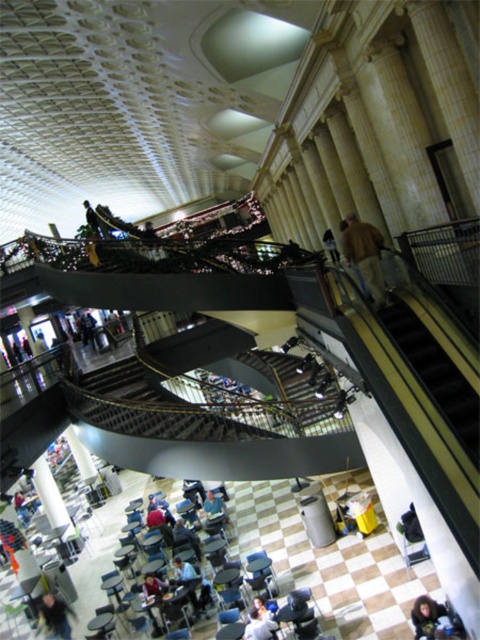
Question: Which point is closer to the camera?

Choices:
 (A) (155, 236)
 (B) (467, 401)
 (C) (264, 618)
 (D) (297, 362)

Answer: (B)

Question: Which object appears farthest from the camera in this image?

Choices:
 (A) brown leather jacket at upper right
 (B) metallic staircase at center

Answer: (B)

Question: In this image, where is metallic staircase at center located relative to dark blue jeans at lower left?

Choices:
 (A) above
 (B) below

Answer: (A)

Question: Observing the image, what is the correct spatial positioning of brown leather jacket at upper right in reference to dark blue jeans at lower left?

Choices:
 (A) below
 (B) above

Answer: (B)

Question: Does yellow/yellowish/golden metal stairs at right appear over dark brown leather jacket at upper left?

Choices:
 (A) yes
 (B) no

Answer: (B)

Question: Estimate the real-world distances between objects in this image. Which object is closer to the dark brown leather jacket at upper center?

Choices:
 (A) metallic gray staircase at center
 (B) metallic staircase at center
 (C) white fabric bag at lower center
 (D) dark blue jeans at lower left

Answer: (B)